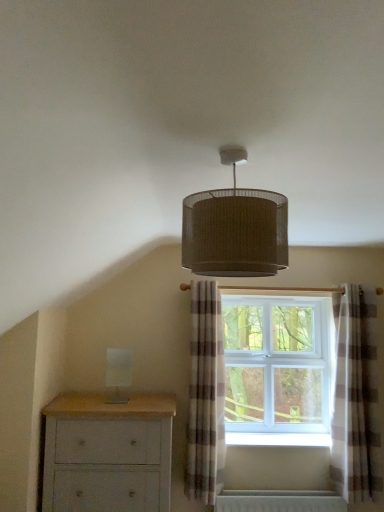
Question: In which direction should I rotate to look at plaid fabric curtain at center, which ranks as the first curtain in left-to-right order?

Choices:
 (A) right
 (B) left

Answer: (A)

Question: Is plaid fabric curtain at center, the 2th curtain from the right, positioned before light gray painted wood chest of drawers at lower left?

Choices:
 (A) yes
 (B) no

Answer: (B)

Question: From the image's perspective, is plaid fabric curtain at center, which ranks as the first curtain in left-to-right order, located above light gray painted wood chest of drawers at lower left?

Choices:
 (A) yes
 (B) no

Answer: (A)

Question: Can you confirm if plaid fabric curtain at center, the 2th curtain from the right, is bigger than light gray painted wood chest of drawers at lower left?

Choices:
 (A) yes
 (B) no

Answer: (B)

Question: Can you confirm if plaid fabric curtain at center, the 2th curtain from the right, is wider than light gray painted wood chest of drawers at lower left?

Choices:
 (A) no
 (B) yes

Answer: (A)

Question: Considering the relative sizes of plaid fabric curtain at center, the 2th curtain from the right, and light gray painted wood chest of drawers at lower left in the image provided, is plaid fabric curtain at center, the 2th curtain from the right, thinner than light gray painted wood chest of drawers at lower left?

Choices:
 (A) yes
 (B) no

Answer: (A)

Question: From a real-world perspective, does plaid fabric curtain at center, the 2th curtain from the right, stand above light gray painted wood chest of drawers at lower left?

Choices:
 (A) yes
 (B) no

Answer: (A)

Question: Is light gray painted wood chest of drawers at lower left far from white plastic window at center?

Choices:
 (A) no
 (B) yes

Answer: (A)

Question: Is light gray painted wood chest of drawers at lower left further to camera compared to white plastic window at center?

Choices:
 (A) yes
 (B) no

Answer: (B)

Question: Can you confirm if light gray painted wood chest of drawers at lower left is shorter than white plastic window at center?

Choices:
 (A) no
 (B) yes

Answer: (B)

Question: Is light gray painted wood chest of drawers at lower left facing towards white plastic window at center?

Choices:
 (A) no
 (B) yes

Answer: (A)

Question: From a real-world perspective, is light gray painted wood chest of drawers at lower left on top of white plastic window at center?

Choices:
 (A) no
 (B) yes

Answer: (A)

Question: Considering the relative positions of light gray painted wood chest of drawers at lower left and white plastic window at center in the image provided, is light gray painted wood chest of drawers at lower left to the left of white plastic window at center from the viewer's perspective?

Choices:
 (A) yes
 (B) no

Answer: (A)

Question: Is light gray painted wood chest of drawers at lower left taller than plaid fabric curtain at center, which ranks as the first curtain in left-to-right order?

Choices:
 (A) yes
 (B) no

Answer: (B)